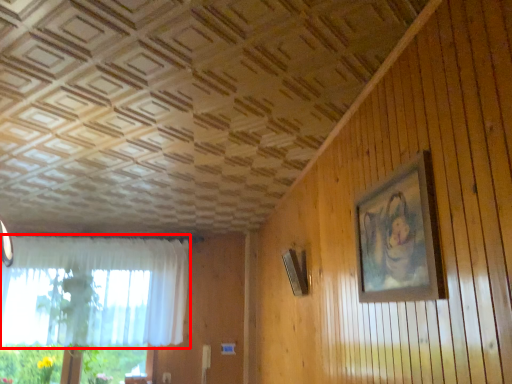
Question: From the image's perspective, what is the correct spatial relationship of curtain (annotated by the red box) in relation to picture frame?

Choices:
 (A) above
 (B) below

Answer: (B)